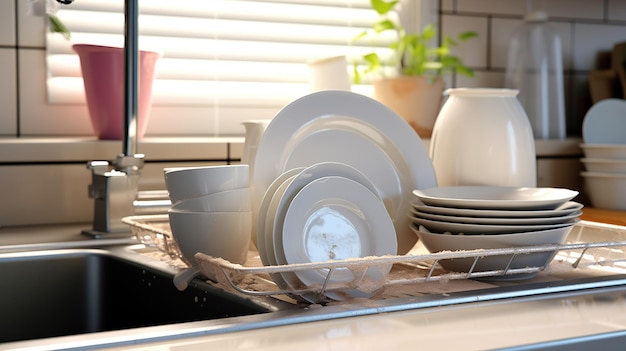
The height and width of the screenshot is (351, 626). I want to click on blinds, so click(x=59, y=81), click(x=63, y=66), click(x=54, y=44), click(x=79, y=19), click(x=96, y=1).